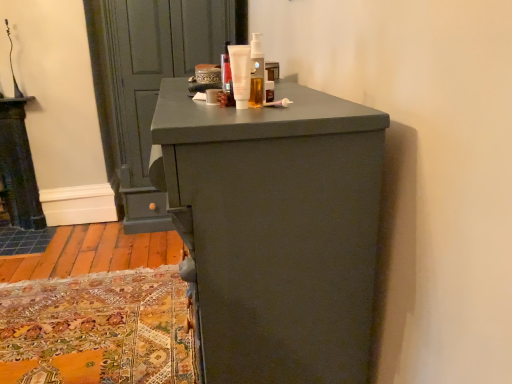
Image resolution: width=512 pixels, height=384 pixels. Find the location of `translucent plastic bottle at upper center, which is the 1th toiletry from right to left`. translucent plastic bottle at upper center, which is the 1th toiletry from right to left is located at coordinates (257, 72).

Image resolution: width=512 pixels, height=384 pixels. What do you see at coordinates (240, 73) in the screenshot?
I see `white matte tube at center, positioned as the 2th toiletry in right-to-left order` at bounding box center [240, 73].

Where is `matte gray door at upper left`? This screenshot has height=384, width=512. matte gray door at upper left is located at coordinates (148, 82).

Is translucent plastic bottle at upper center, which is the 3th toiletry from left to right, not near white matte tube at center, acting as the 2th toiletry starting from the left?

No, there isn't a large distance between translucent plastic bottle at upper center, which is the 3th toiletry from left to right, and white matte tube at center, acting as the 2th toiletry starting from the left.

How distant is translucent plastic bottle at upper center, which is the 1th toiletry from right to left, from white matte tube at center, acting as the 2th toiletry starting from the left?

translucent plastic bottle at upper center, which is the 1th toiletry from right to left, and white matte tube at center, acting as the 2th toiletry starting from the left, are 1.70 inches apart.

From the picture: Is translucent plastic bottle at upper center, which is the 1th toiletry from right to left, smaller than white matte tube at center, acting as the 2th toiletry starting from the left?

No.

From a real-world perspective, which object rests below the other?

white matte tube at center, positioned as the 2th toiletry in right-to-left order.

From a real-world perspective, between white matte tube at center, acting as the 2th toiletry starting from the left, and matte gray chest of drawers at center, who is vertically lower?

matte gray chest of drawers at center.

Is white matte tube at center, positioned as the 2th toiletry in right-to-left order, far away from matte gray chest of drawers at center?

Actually, white matte tube at center, positioned as the 2th toiletry in right-to-left order, and matte gray chest of drawers at center are a little close together.

Could matte gray chest of drawers at center be considered to be inside white matte tube at center, acting as the 2th toiletry starting from the left?

No, white matte tube at center, acting as the 2th toiletry starting from the left, does not contain matte gray chest of drawers at center.

Between matte gray door at upper left and white matte tube at center, positioned as the 2th toiletry in right-to-left order, which one appears on the right side from the viewer's perspective?

white matte tube at center, positioned as the 2th toiletry in right-to-left order.

Can white matte tube at center, positioned as the 2th toiletry in right-to-left order, be found inside matte gray door at upper left?

No.

How many degrees apart are the facing directions of matte gray door at upper left and white matte tube at center, acting as the 2th toiletry starting from the left?

The angle between the facing direction of matte gray door at upper left and the facing direction of white matte tube at center, acting as the 2th toiletry starting from the left, is 89.4 degrees.

Is point (103, 61) closer to viewer compared to point (231, 46)?

That is False.

Is matte gray door at upper left not within matte gray chest of drawers at center?

Yes, matte gray door at upper left is outside of matte gray chest of drawers at center.

From a real-world perspective, is matte gray door at upper left over matte gray chest of drawers at center?

Yes.

Is matte gray door at upper left next to matte gray chest of drawers at center and touching it?

No, matte gray door at upper left is not touching matte gray chest of drawers at center.

Is matte gray chest of drawers at center a part of translucent plastic bottle at upper center, which is the 3th toiletry from left to right?

Definitely not — matte gray chest of drawers at center is not inside translucent plastic bottle at upper center, which is the 3th toiletry from left to right.

Is translucent plastic bottle at upper center, which is the 3th toiletry from left to right, shorter than matte gray chest of drawers at center?

Indeed, translucent plastic bottle at upper center, which is the 3th toiletry from left to right, has a lesser height compared to matte gray chest of drawers at center.

Can you confirm if translucent plastic bottle at upper center, which is the 1th toiletry from right to left, is positioned to the left of matte gray chest of drawers at center?

In fact, translucent plastic bottle at upper center, which is the 1th toiletry from right to left, is to the right of matte gray chest of drawers at center.

Is translucent plastic bottle at upper center, which is the 3th toiletry from left to right, not close to matte gray chest of drawers at center?

translucent plastic bottle at upper center, which is the 3th toiletry from left to right, is actually quite close to matte gray chest of drawers at center.

Does white matte tube at center, acting as the 2th toiletry starting from the left, turn towards matte gray door at upper left?

No, white matte tube at center, acting as the 2th toiletry starting from the left, is not oriented towards matte gray door at upper left.

Is the surface of white matte tube at center, positioned as the 2th toiletry in right-to-left order, in direct contact with matte gray door at upper left?

No, white matte tube at center, positioned as the 2th toiletry in right-to-left order, is not in contact with matte gray door at upper left.

Which is less distant, (232,48) or (170,10)?

Point (232,48) is closer to the camera than point (170,10).

Which is closer, (210, 92) or (114, 175)?

Point (210, 92) is positioned closer to the camera compared to point (114, 175).

From the picture: Between matte white cream at center, placed as the 3th toiletry when sorted from right to left, and matte gray door at upper left, which one appears on the left side from the viewer's perspective?

From the viewer's perspective, matte gray door at upper left appears more on the left side.

How far apart are matte white cream at center, placed as the 3th toiletry when sorted from right to left, and matte gray door at upper left?

A distance of 6.21 feet exists between matte white cream at center, placed as the 3th toiletry when sorted from right to left, and matte gray door at upper left.

Could matte gray door at upper left be considered to be inside matte white cream at center, which is counted as the first toiletry, starting from the left?

No.

Where is `toiletry in front of the translucent plastic bottle at upper center, which is the 1th toiletry from right to left`? This screenshot has height=384, width=512. toiletry in front of the translucent plastic bottle at upper center, which is the 1th toiletry from right to left is located at coordinates (240, 73).

Starting from the matte gray chest of drawers at center, which toiletry is the 1st one behind? Please provide its 2D coordinates.

[(240, 73)]

From the image, which object appears to be farther from matte white cream at center, which is counted as the first toiletry, starting from the left, matte gray chest of drawers at center or white matte tube at center, acting as the 2th toiletry starting from the left?

matte gray chest of drawers at center.

From the image, which object appears to be nearer to matte gray chest of drawers at center, matte gray door at upper left or white matte tube at center, acting as the 2th toiletry starting from the left?

white matte tube at center, acting as the 2th toiletry starting from the left, is positioned closer to the anchor matte gray chest of drawers at center.

Considering their positions, is matte gray chest of drawers at center positioned closer to matte gray door at upper left than translucent plastic bottle at upper center, which is the 3th toiletry from left to right?

matte gray chest of drawers at center is closer to matte gray door at upper left.

Estimate the real-world distances between objects in this image. Which object is closer to matte gray chest of drawers at center, matte white cream at center, placed as the 3th toiletry when sorted from right to left, or translucent plastic bottle at upper center, which is the 1th toiletry from right to left?

translucent plastic bottle at upper center, which is the 1th toiletry from right to left, lies closer to matte gray chest of drawers at center than the other object.

Based on their spatial positions, is white matte tube at center, positioned as the 2th toiletry in right-to-left order, or matte gray door at upper left further from matte white cream at center, which is counted as the first toiletry, starting from the left?

matte gray door at upper left.

Considering their positions, is white matte tube at center, acting as the 2th toiletry starting from the left, positioned further to matte white cream at center, placed as the 3th toiletry when sorted from right to left, than translucent plastic bottle at upper center, which is the 3th toiletry from left to right?

Among the two, translucent plastic bottle at upper center, which is the 3th toiletry from left to right, is located further to matte white cream at center, placed as the 3th toiletry when sorted from right to left.

Based on their spatial positions, is matte white cream at center, which is counted as the first toiletry, starting from the left, or white matte tube at center, positioned as the 2th toiletry in right-to-left order, closer to translucent plastic bottle at upper center, which is the 3th toiletry from left to right?

The object closer to translucent plastic bottle at upper center, which is the 3th toiletry from left to right, is white matte tube at center, positioned as the 2th toiletry in right-to-left order.

Estimate the real-world distances between objects in this image. Which object is closer to matte gray door at upper left, white matte tube at center, positioned as the 2th toiletry in right-to-left order, or matte white cream at center, which is counted as the first toiletry, starting from the left?

The object closer to matte gray door at upper left is matte white cream at center, which is counted as the first toiletry, starting from the left.

The height and width of the screenshot is (384, 512). I want to click on toiletry that lies between white matte tube at center, acting as the 2th toiletry starting from the left, and matte gray chest of drawers at center from top to bottom, so click(x=213, y=96).

This screenshot has height=384, width=512. I want to click on toiletry between white matte tube at center, positioned as the 2th toiletry in right-to-left order, and matte white cream at center, which is counted as the first toiletry, starting from the left, from front to back, so click(257, 72).

At what (x,y) coordinates should I click in order to perform the action: click on toiletry between translucent plastic bottle at upper center, which is the 3th toiletry from left to right, and matte gray door at upper left, along the z-axis. Please return your answer as a coordinate pair (x, y). Image resolution: width=512 pixels, height=384 pixels. Looking at the image, I should click on (213, 96).